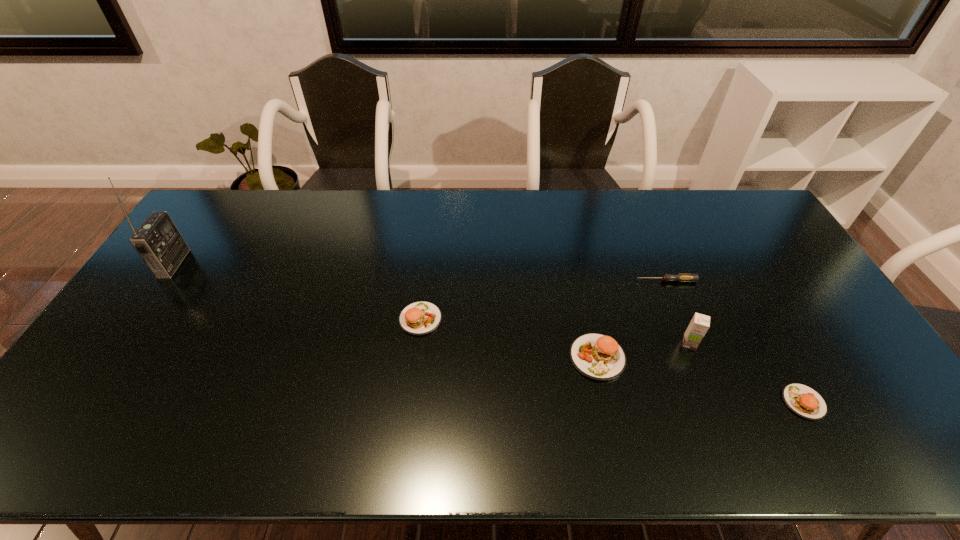
Locate an element on the screen. vacant space that satisfies the following two spatial constraints: 1. on the back side of the second patty from left to right; 2. on the display of the radio receiver is located at coordinates (577, 263).